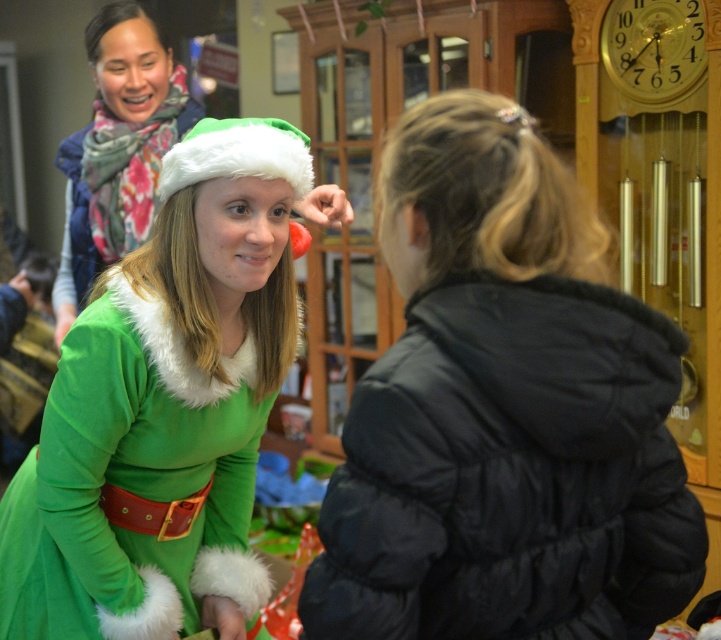
Question: Considering the real-world distances, which object is farthest from the white fluffy santa hat at center?

Choices:
 (A) matte green fur-trimmed dress at center
 (B) green felt santa outfit at center

Answer: (A)

Question: In this image, where is green felt santa outfit at center located relative to white fluffy santa hat at center?

Choices:
 (A) below
 (B) above

Answer: (A)

Question: Estimate the real-world distances between objects in this image. Which object is farther from the matte green fur-trimmed dress at center?

Choices:
 (A) white fluffy santa hat at center
 (B) black puffy coat at right
 (C) green felt santa outfit at center

Answer: (B)

Question: Can you confirm if green felt santa outfit at center is wider than matte green fur-trimmed dress at center?

Choices:
 (A) no
 (B) yes

Answer: (B)

Question: Can you confirm if black puffy coat at right is smaller than white fluffy santa hat at center?

Choices:
 (A) no
 (B) yes

Answer: (A)

Question: Among these objects, which one is farthest from the camera?

Choices:
 (A) white fluffy santa hat at center
 (B) matte green fur-trimmed dress at center
 (C) green felt santa outfit at center
 (D) black puffy coat at right

Answer: (B)